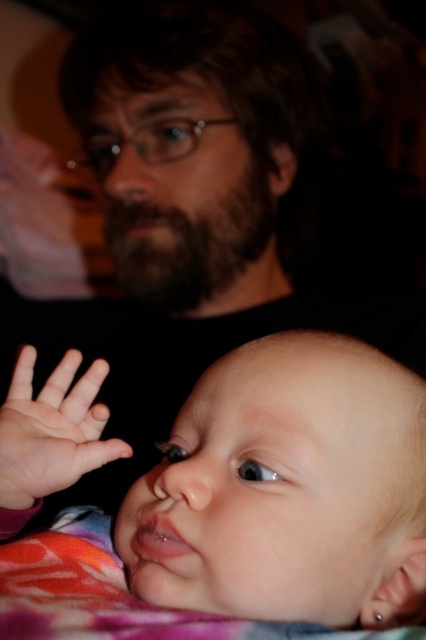
Which is more to the right, smooth skin baby at lower left or pink smooth skin at lower left?

From the viewer's perspective, smooth skin baby at lower left appears more on the right side.

Is smooth skin baby at lower left bigger than pink smooth skin at lower left?

Indeed, smooth skin baby at lower left has a larger size compared to pink smooth skin at lower left.

In order to click on smooth skin baby at lower left in this screenshot , I will do `click(252, 509)`.

Find the location of a particular element. smooth skin baby at lower left is located at coordinates (252, 509).

Does fluffy pink blanket at lower left appear on the left side of pink smooth skin at lower left?

No, fluffy pink blanket at lower left is not to the left of pink smooth skin at lower left.

Does fluffy pink blanket at lower left come behind pink smooth skin at lower left?

No, it is not.

What do you see at coordinates (115, 595) in the screenshot? The image size is (426, 640). I see `fluffy pink blanket at lower left` at bounding box center [115, 595].

I want to click on fluffy pink blanket at lower left, so click(115, 595).

Which is more to the right, smooth skin baby at lower left or fluffy pink blanket at lower left?

smooth skin baby at lower left

Is point (333, 336) less distant than point (178, 628)?

No.

Is point (328, 512) less distant than point (6, 627)?

No, (328, 512) is behind (6, 627).

What are the coordinates of `smooth skin baby at lower left` in the screenshot? It's located at (252, 509).